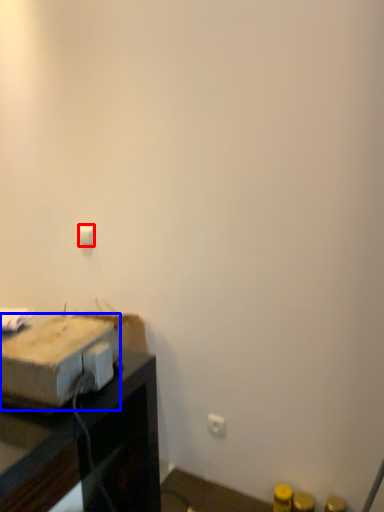
Question: Which object appears farthest to the camera in this image, light switch (highlighted by a red box) or cardboard box (highlighted by a blue box)?

Choices:
 (A) light switch
 (B) cardboard box

Answer: (A)